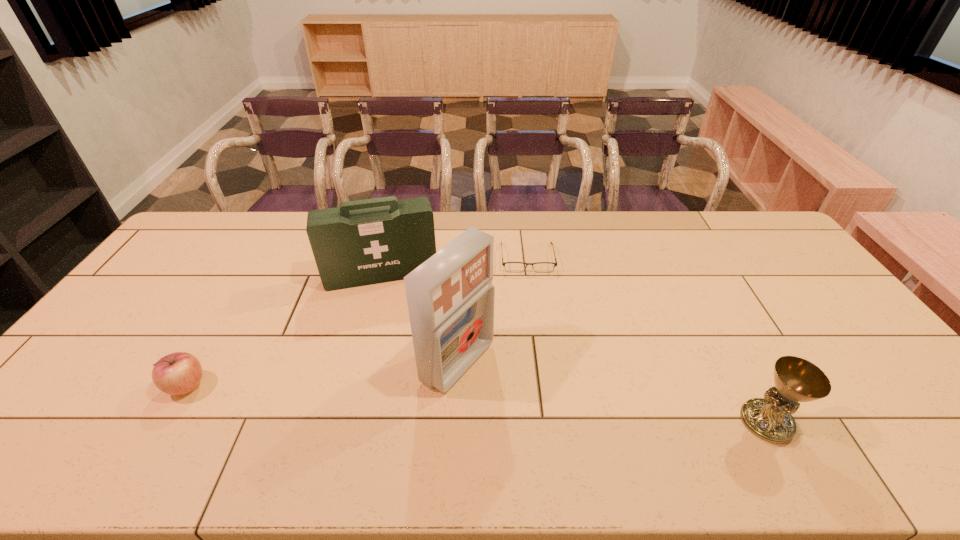
Image resolution: width=960 pixels, height=540 pixels. What are the coordinates of `free point that satisfies the following two spatial constraints: 1. on the front side of the nearer first-aid kit; 2. on the left side of the chalice` in the screenshot? It's located at (455, 422).